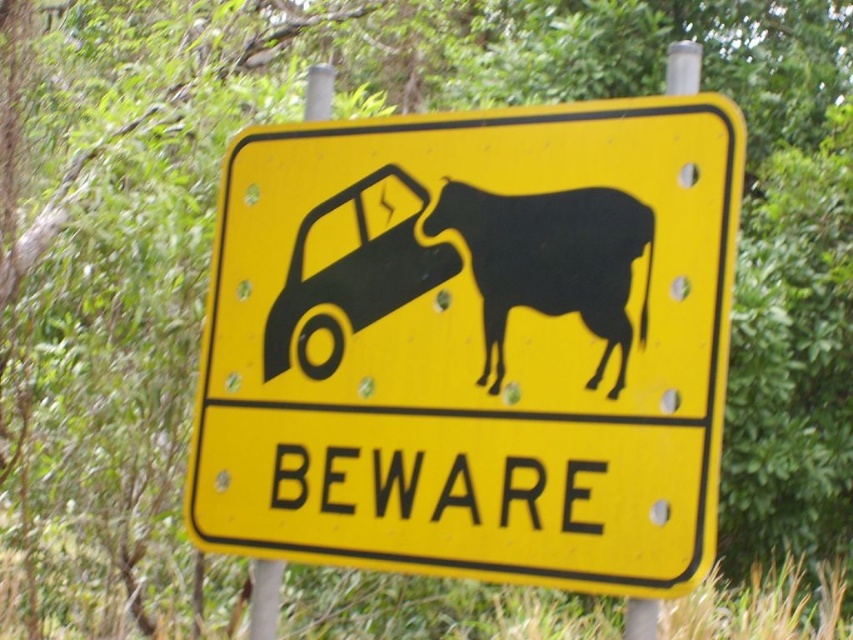
Which is below, black matte bull at center or black matte car at left?

black matte bull at center is lower down.

Which is behind, point (537, 260) or point (442, 268)?

The point (442, 268) is more distant.

Where is `black matte bull at center`? This screenshot has width=853, height=640. black matte bull at center is located at coordinates (550, 260).

Based on the photo, which is above, yellow matte sign at center or black matte bull at center?

black matte bull at center

Is yellow matte sign at center above black matte bull at center?

No.

The height and width of the screenshot is (640, 853). What are the coordinates of `yellow matte sign at center` in the screenshot? It's located at (473, 342).

Is yellow matte sign at center to the left of black matte car at left from the viewer's perspective?

Incorrect, yellow matte sign at center is not on the left side of black matte car at left.

Between yellow matte sign at center and black matte car at left, which one is positioned lower?

yellow matte sign at center is lower down.

In the scene shown: Who is more distant from viewer, (674, 150) or (316, 298)?

Point (316, 298)

Where is `yellow matte sign at center`? The height and width of the screenshot is (640, 853). yellow matte sign at center is located at coordinates (473, 342).